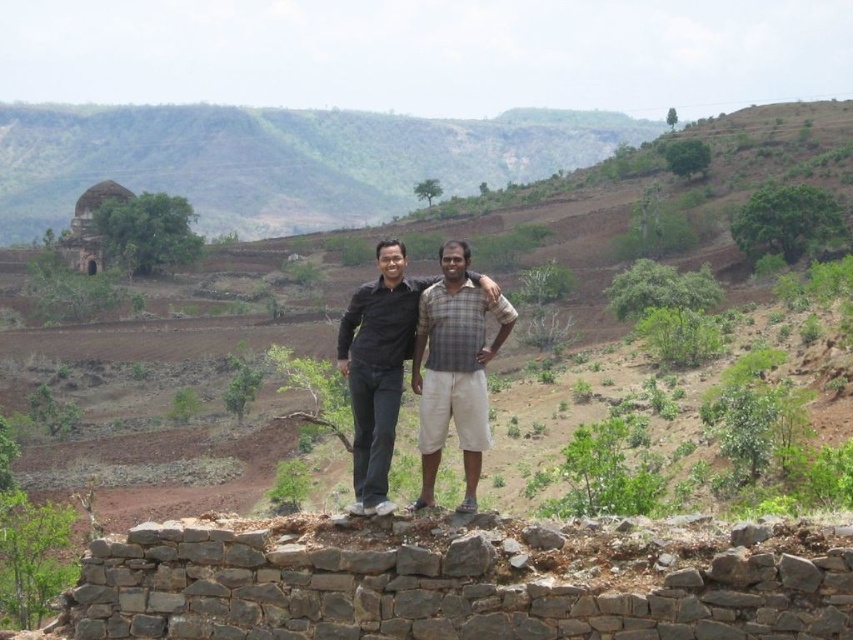
Question: Does brown earthy hillside at center have a larger size compared to brown earthy hillside at left?

Choices:
 (A) no
 (B) yes

Answer: (B)

Question: Which object appears closest to the camera in this image?

Choices:
 (A) brown earthy hillside at center
 (B) matte black shirt at center

Answer: (B)

Question: Which point is closer to the camera?

Choices:
 (A) (315, 211)
 (B) (383, 260)
 (C) (21, 404)

Answer: (B)

Question: Which object is farther from the camera taking this photo?

Choices:
 (A) matte black shirt at center
 (B) brown earthy hillside at center

Answer: (B)

Question: Is brown earthy hillside at center to the left of brown earthy hillside at left from the viewer's perspective?

Choices:
 (A) no
 (B) yes

Answer: (A)

Question: Is brown earthy hillside at center to the left of brown earthy hillside at left from the viewer's perspective?

Choices:
 (A) yes
 (B) no

Answer: (B)